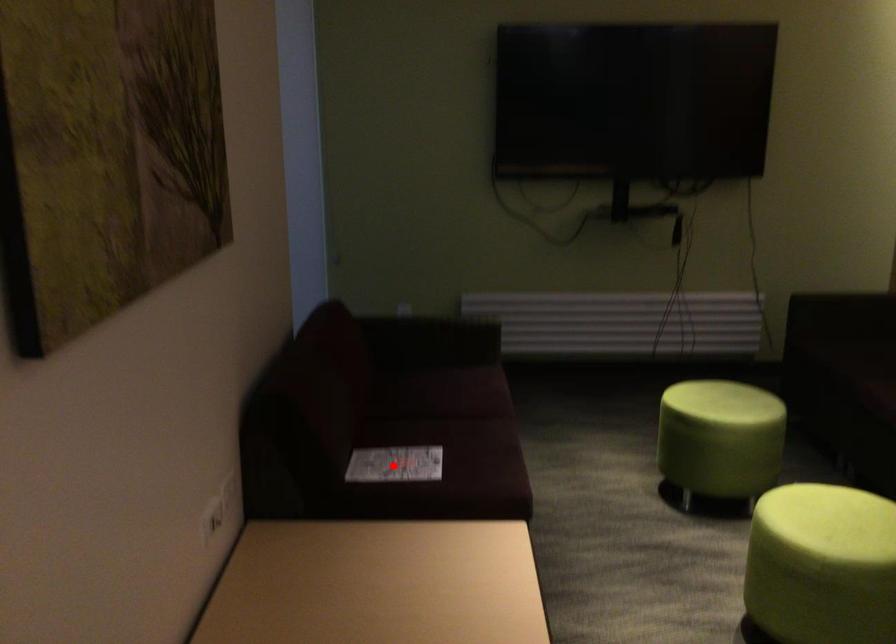
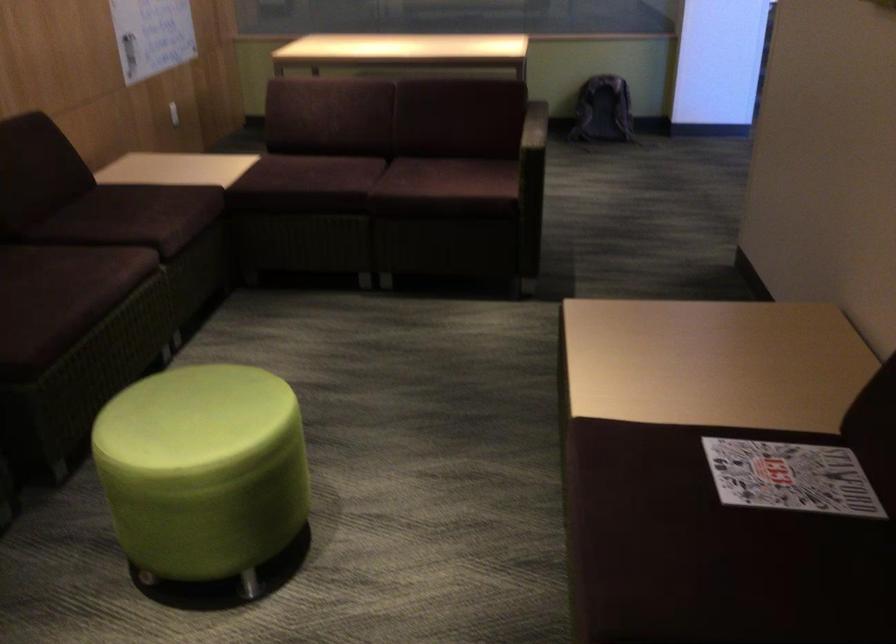
Locate, in the second image, the point that corresponds to the highlighted location in the first image.

(790, 477)